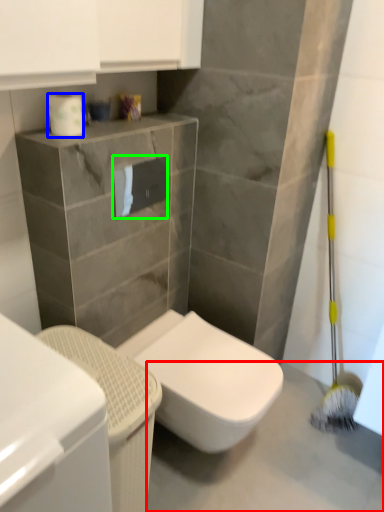
Question: Considering the real-world distances, which object is closest to concrete (highlighted by a red box)? toilet paper (highlighted by a blue box) or toilet paper (highlighted by a green box).

Choices:
 (A) toilet paper
 (B) toilet paper

Answer: (B)